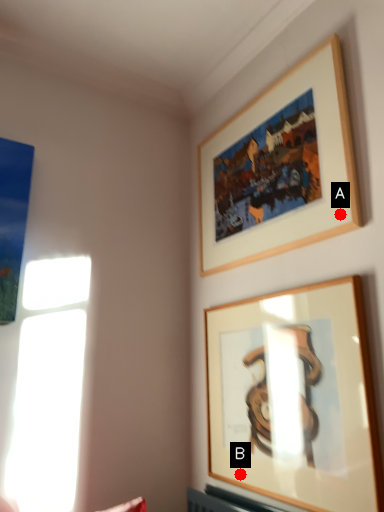
Question: Two points are circled on the image, labeled by A and B beside each circle. Which point is closer to the camera?

Choices:
 (A) A is closer
 (B) B is closer

Answer: (A)